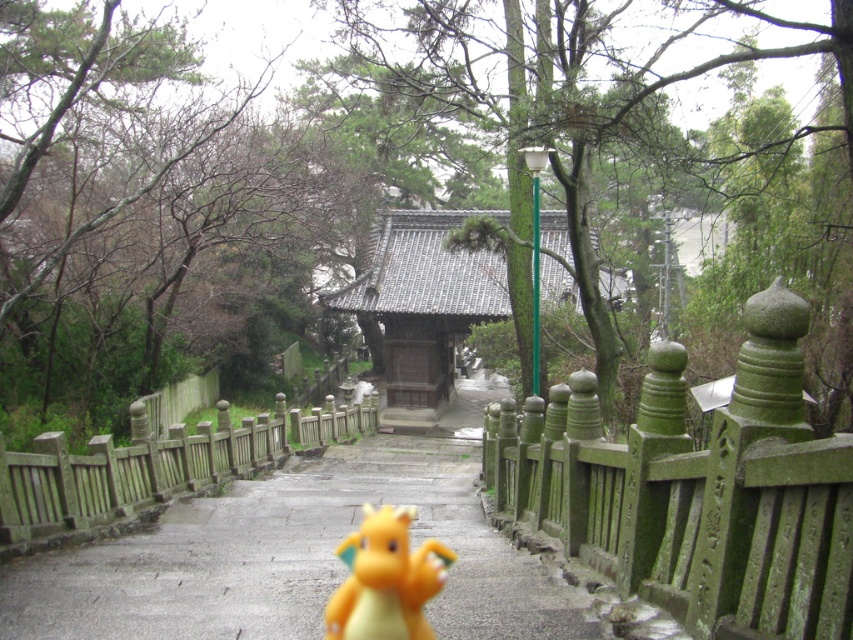
Can you confirm if green mossy stone fence at right is positioned above yellow rubber dragon at center?

Indeed, green mossy stone fence at right is positioned over yellow rubber dragon at center.

I want to click on green mossy stone fence at right, so click(x=694, y=488).

Is point (767, 291) positioned behind point (399, 522)?

No, (767, 291) is in front of (399, 522).

The width and height of the screenshot is (853, 640). What are the coordinates of `green mossy stone fence at right` in the screenshot? It's located at (694, 488).

Measure the distance from green mossy wood fence at left to yellow rubber dragon at center.

7.20 meters

Which is above, green mossy wood fence at left or yellow rubber dragon at center?

Positioned higher is yellow rubber dragon at center.

Who is more distant from viewer, (82, 488) or (360, 628)?

Point (82, 488)

The image size is (853, 640). In order to click on green mossy wood fence at left in this screenshot , I will do 151,467.

Does green mossy stone fence at right have a smaller size compared to green mossy wood fence at left?

Yes, green mossy stone fence at right is smaller than green mossy wood fence at left.

Image resolution: width=853 pixels, height=640 pixels. What do you see at coordinates (694, 488) in the screenshot? I see `green mossy stone fence at right` at bounding box center [694, 488].

The image size is (853, 640). Identify the location of green mossy stone fence at right. (694, 488).